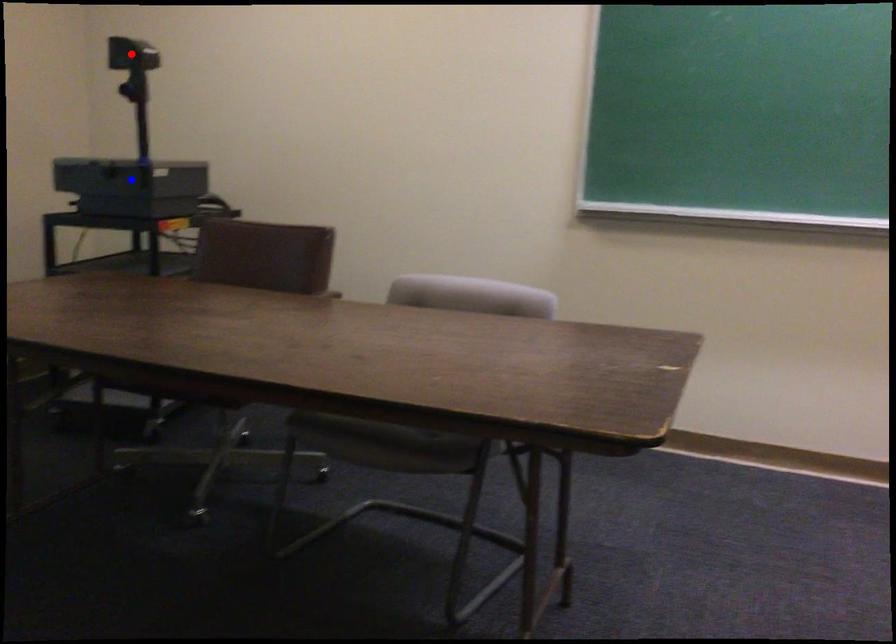
Question: In the image, two points are highlighted. Which point is nearer to the camera? Reply with the corresponding letter.

Choices:
 (A) blue point
 (B) red point

Answer: (A)